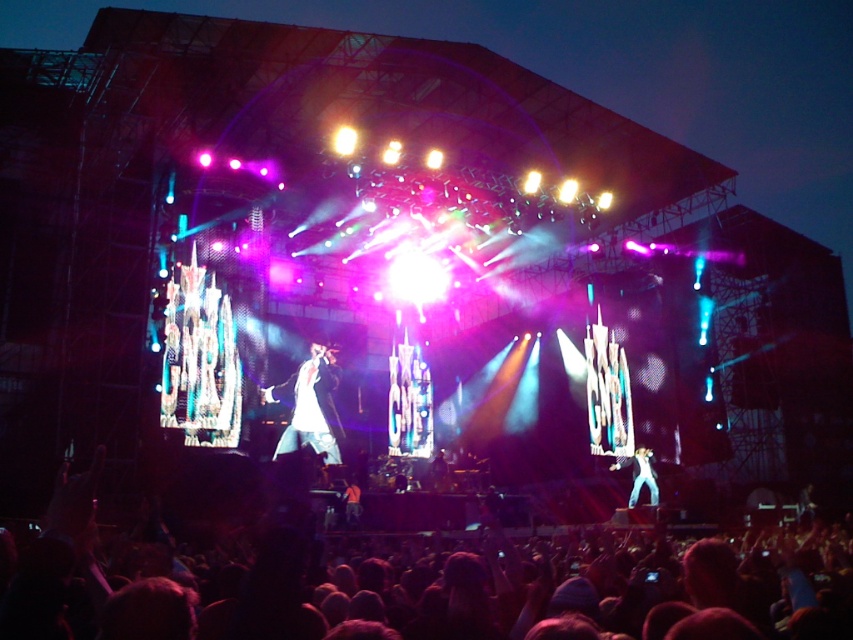
Is white glossy suit at center further to camera compared to white cotton shirt at center?

No, white glossy suit at center is in front of white cotton shirt at center.

Find the location of a particular element. white glossy suit at center is located at coordinates (310, 406).

Where is `white glossy suit at center`? The height and width of the screenshot is (640, 853). white glossy suit at center is located at coordinates (310, 406).